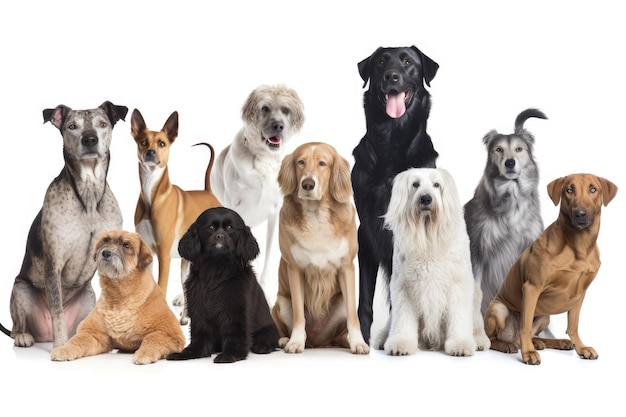
Where is `right front leg`? Image resolution: width=626 pixels, height=417 pixels. right front leg is located at coordinates (52, 288), (89, 338), (195, 329), (295, 284), (367, 286), (401, 306), (478, 273), (523, 314).